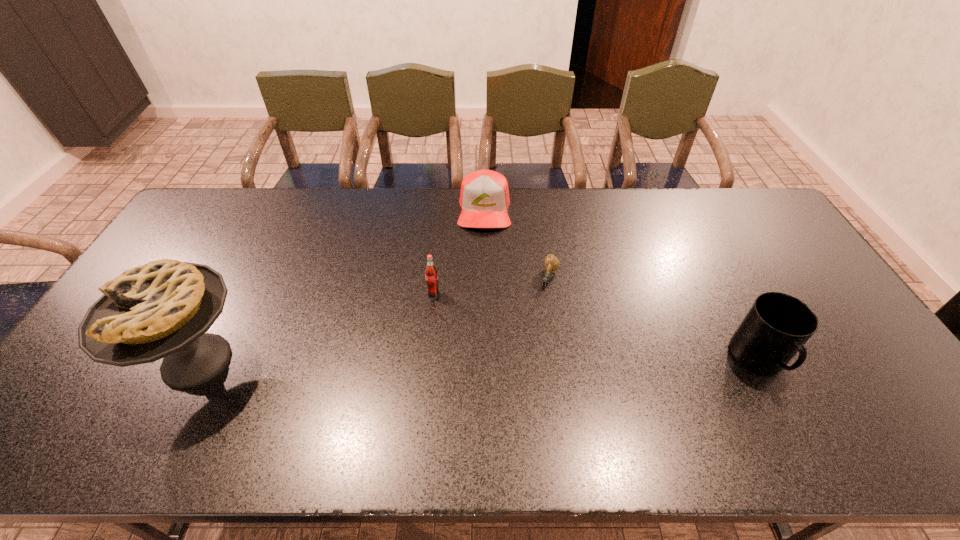
I want to click on the tallest object, so click(163, 309).

Identify the location of the leftmost object. (163, 309).

Locate an element on the screen. the rightmost object is located at coordinates (776, 327).

I want to click on the second object from right to left, so click(x=551, y=262).

Locate an element on the screen. the shortest object is located at coordinates (551, 262).

I want to click on the farthest object, so click(x=484, y=197).

Where is `the third object from left to right`? the third object from left to right is located at coordinates (484, 197).

Identify the location of soda bottle. (431, 273).

Where is `blank area located on the cut side of the leftmost object`? The width and height of the screenshot is (960, 540). blank area located on the cut side of the leftmost object is located at coordinates (115, 360).

The width and height of the screenshot is (960, 540). I want to click on free space located 0.130m on the cut side of the leftmost object, so click(88, 360).